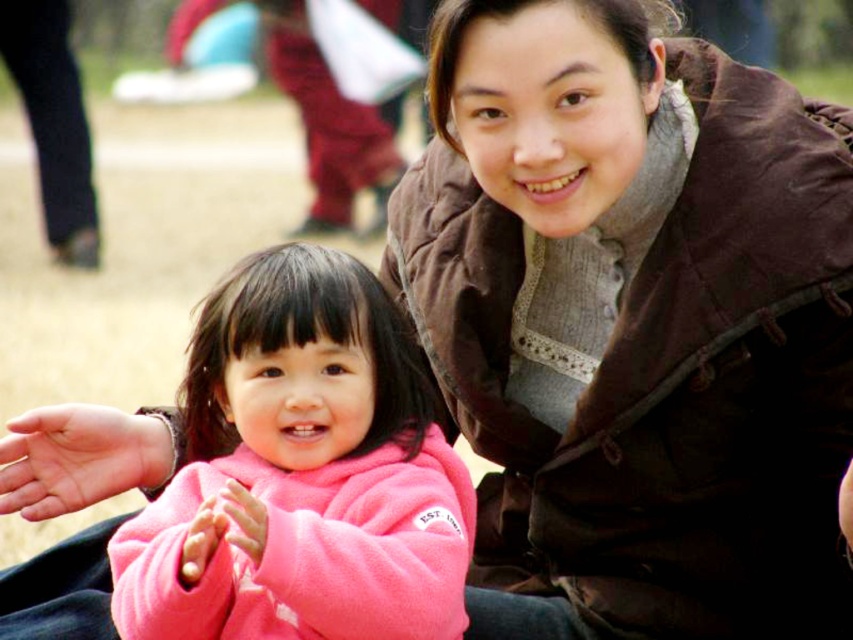
Question: Can you confirm if brown velvety jacket at center is positioned below pink fleece jacket at center?

Choices:
 (A) yes
 (B) no

Answer: (B)

Question: Which of the following is the farthest from the observer?

Choices:
 (A) brown velvety jacket at center
 (B) smooth brown leather hand at center

Answer: (B)

Question: Does brown velvety jacket at center have a smaller size compared to pink fleece jacket at center?

Choices:
 (A) no
 (B) yes

Answer: (A)

Question: Is brown velvety jacket at center to the right of pink fleece jacket at center from the viewer's perspective?

Choices:
 (A) no
 (B) yes

Answer: (B)

Question: Which of the following is the farthest from the observer?

Choices:
 (A) smooth brown leather hand at center
 (B) pink fleece jacket at center
 (C) brown velvety jacket at center

Answer: (A)

Question: Which point is closer to the camera taking this photo?

Choices:
 (A) (631, 584)
 (B) (119, 481)

Answer: (B)